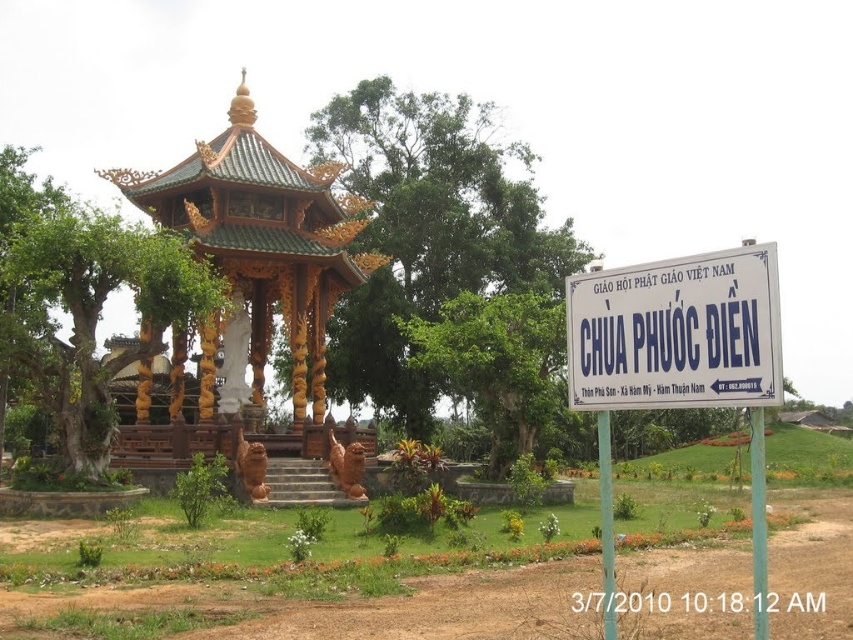
Question: Does white plastic sign at right lie behind white plastic sign at center?

Choices:
 (A) no
 (B) yes

Answer: (B)

Question: Does golden wood gazebo at center appear on the left side of white plastic sign at center?

Choices:
 (A) yes
 (B) no

Answer: (A)

Question: Which object appears farthest from the camera in this image?

Choices:
 (A) white plastic sign at center
 (B) golden wood gazebo at center

Answer: (B)

Question: Which object is farther from the camera taking this photo?

Choices:
 (A) white plastic sign at right
 (B) white plastic sign at center

Answer: (A)

Question: Is white plastic sign at right positioned in front of white plastic sign at center?

Choices:
 (A) no
 (B) yes

Answer: (A)

Question: Which point is farther to the camera?

Choices:
 (A) (654, 385)
 (B) (148, 179)

Answer: (B)